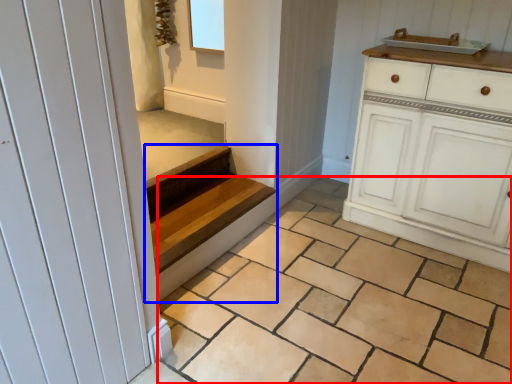
Question: Which object is further to the camera taking this photo, tile (highlighted by a red box) or stairs (highlighted by a blue box)?

Choices:
 (A) tile
 (B) stairs

Answer: (B)